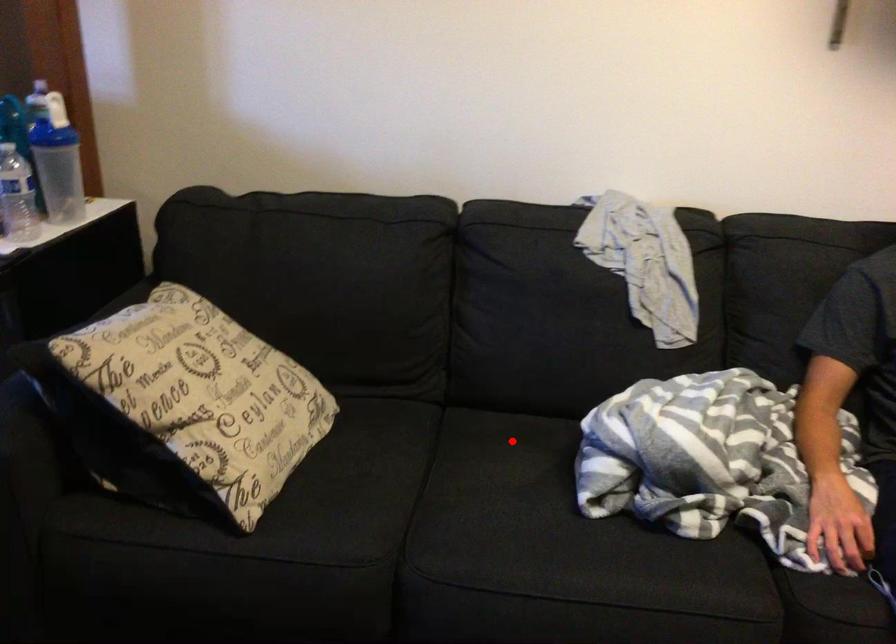
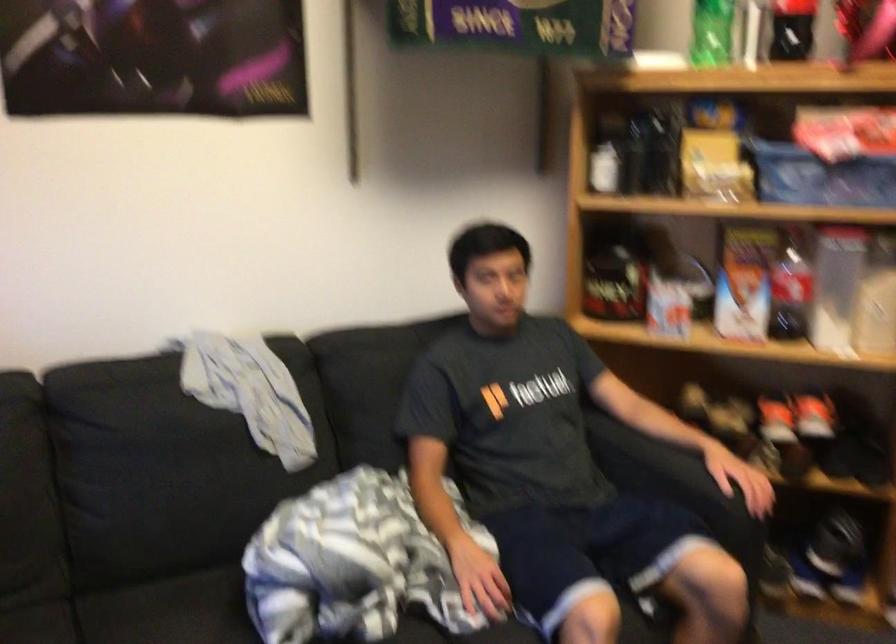
In the second image, find the point that corresponds to the highlighted location in the first image.

(169, 611)